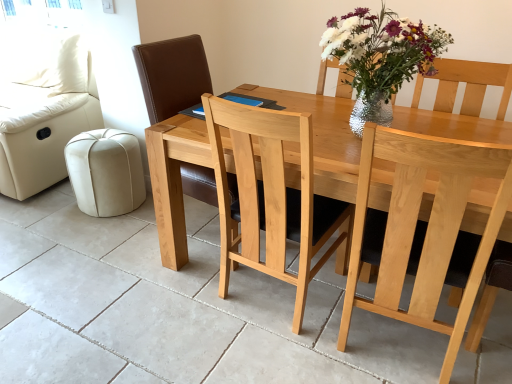
Question: From the image's perspective, is beige leather ottoman at lower left below cream leather couch at left?

Choices:
 (A) yes
 (B) no

Answer: (A)

Question: Considering the relative sizes of beige leather ottoman at lower left and cream leather couch at left in the image provided, is beige leather ottoman at lower left thinner than cream leather couch at left?

Choices:
 (A) yes
 (B) no

Answer: (A)

Question: Is beige leather ottoman at lower left shorter than cream leather couch at left?

Choices:
 (A) no
 (B) yes

Answer: (B)

Question: From a real-world perspective, is beige leather ottoman at lower left physically above cream leather couch at left?

Choices:
 (A) yes
 (B) no

Answer: (B)

Question: From the image's perspective, is beige leather ottoman at lower left on top of cream leather couch at left?

Choices:
 (A) yes
 (B) no

Answer: (B)

Question: Can you see beige leather ottoman at lower left touching cream leather couch at left?

Choices:
 (A) no
 (B) yes

Answer: (A)

Question: Considering the relative positions of natural wood chair at center, the first chair positioned from the left, and natural wood table at center in the image provided, is natural wood chair at center, the first chair positioned from the left, to the right of natural wood table at center from the viewer's perspective?

Choices:
 (A) no
 (B) yes

Answer: (A)

Question: Is natural wood chair at center, the first chair positioned from the left, located outside natural wood table at center?

Choices:
 (A) yes
 (B) no

Answer: (B)

Question: Is the depth of natural wood chair at center, the first chair positioned from the left, less than that of natural wood table at center?

Choices:
 (A) no
 (B) yes

Answer: (A)

Question: Does natural wood chair at center, which appears as the second chair when viewed from the right, have a lesser width compared to natural wood table at center?

Choices:
 (A) no
 (B) yes

Answer: (B)

Question: Would you say natural wood chair at center, the first chair positioned from the left, contains natural wood table at center?

Choices:
 (A) yes
 (B) no

Answer: (B)

Question: Considering the relative sizes of natural wood chair at center, the first chair positioned from the left, and natural wood table at center in the image provided, is natural wood chair at center, the first chair positioned from the left, bigger than natural wood table at center?

Choices:
 (A) no
 (B) yes

Answer: (A)

Question: Would you say natural wood chair at center, the first chair positioned from the left, is outside light wood chair at center, the 2th chair in the left-to-right sequence?

Choices:
 (A) yes
 (B) no

Answer: (A)